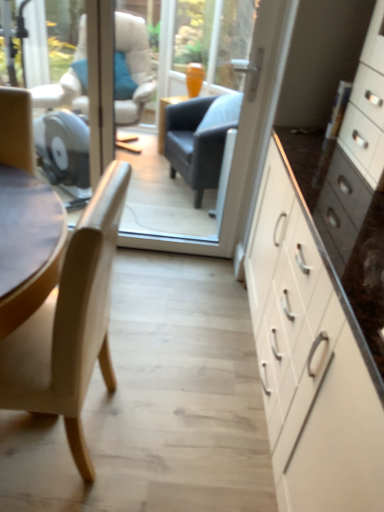
Question: Would you say light beige wood chair at left is to the left or to the right of transparent glass door at center in the picture?

Choices:
 (A) right
 (B) left

Answer: (B)

Question: Considering the positions of point (79, 224) and point (233, 200), is point (79, 224) closer or farther from the camera than point (233, 200)?

Choices:
 (A) farther
 (B) closer

Answer: (B)

Question: Based on their relative distances, which object is farther from the transparent glass door at center?

Choices:
 (A) white glossy cabinet at right
 (B) light beige wood chair at left

Answer: (B)

Question: Estimate the real-world distances between objects in this image. Which object is closer to the light beige wood chair at left?

Choices:
 (A) white glossy cabinet at right
 (B) transparent glass door at center

Answer: (A)